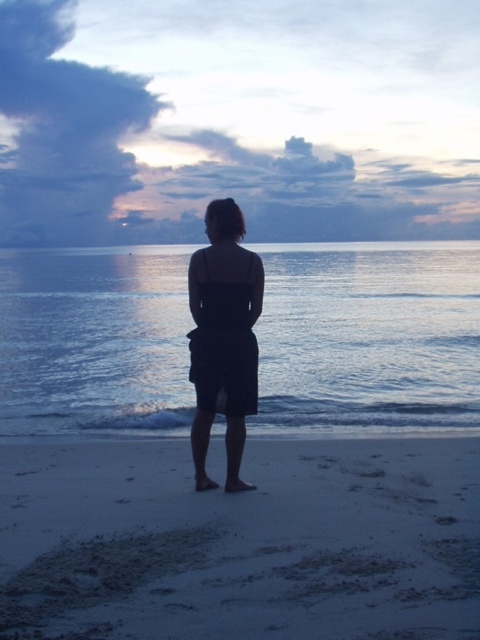
Is the position of white sandy beach at lower center less distant than that of glistening blue water at center?

That is True.

Consider the image. Who is more distant from viewer, (375, 474) or (364, 324)?

The point (364, 324) is behind.

Which is in front, point (216, 545) or point (74, 378)?

Positioned in front is point (216, 545).

Where is `white sandy beach at lower center`? The image size is (480, 640). white sandy beach at lower center is located at coordinates (240, 541).

Can you confirm if white sandy beach at lower center is taller than black matte dress at center?

No.

Between white sandy beach at lower center and black matte dress at center, which one appears on the right side from the viewer's perspective?

white sandy beach at lower center is more to the right.

What do you see at coordinates (240, 541) in the screenshot? This screenshot has height=640, width=480. I see `white sandy beach at lower center` at bounding box center [240, 541].

The width and height of the screenshot is (480, 640). In order to click on white sandy beach at lower center in this screenshot , I will do `click(240, 541)`.

Measure the distance between point (275, 260) and camera.

Point (275, 260) and camera are 53.59 meters apart.

Is glistening blue water at center to the right of black matte dress at center from the viewer's perspective?

No, glistening blue water at center is not to the right of black matte dress at center.

Between point (418, 307) and point (207, 435), which one is positioned behind?

The point (418, 307) is behind.

Find the location of a particular element. Image resolution: width=480 pixels, height=640 pixels. glistening blue water at center is located at coordinates (369, 336).